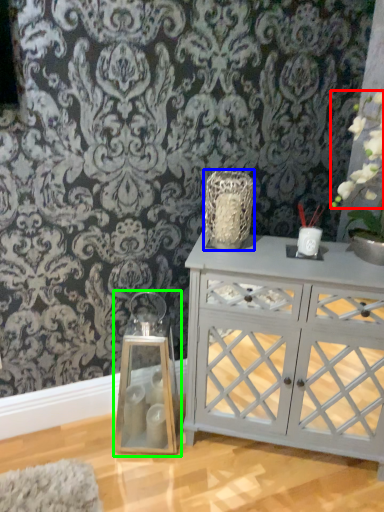
Question: Which is nearer to the floral arrangement (highlighted by a red box)? vase (highlighted by a blue box) or candle holder (highlighted by a green box).

Choices:
 (A) vase
 (B) candle holder

Answer: (A)